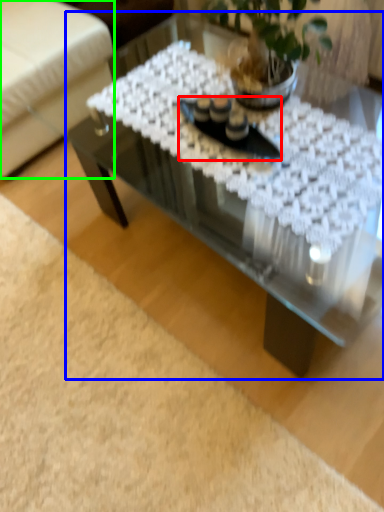
Question: Which object is the closest to the glass plate (highlighted by a red box)? Choose among these: coffee table (highlighted by a blue box) or armchair (highlighted by a green box).

Choices:
 (A) coffee table
 (B) armchair

Answer: (A)